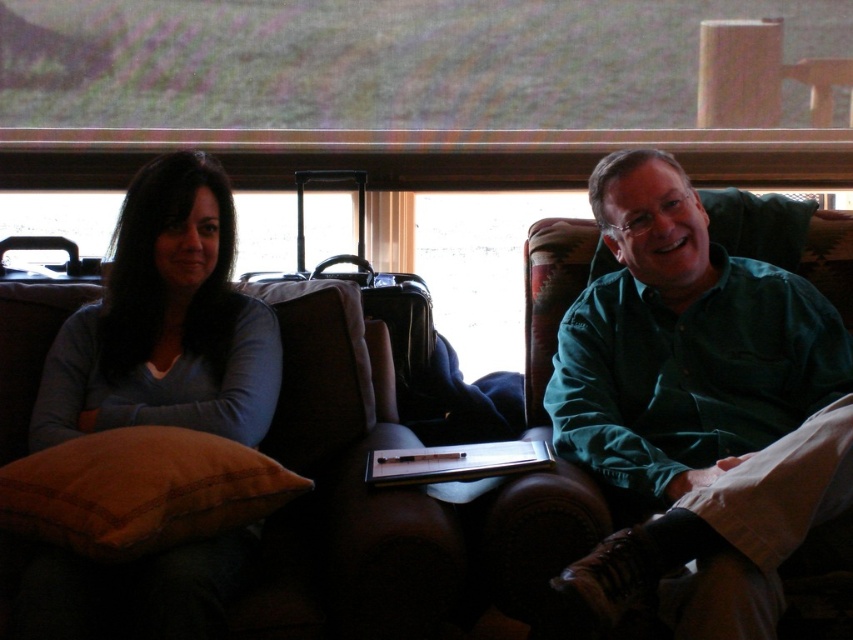
Can you confirm if matte blue shirt at left is bigger than brown velvety pillow at lower left?

Indeed, matte blue shirt at left has a larger size compared to brown velvety pillow at lower left.

Which is more to the left, matte blue shirt at left or brown velvety pillow at lower left?

From the viewer's perspective, matte blue shirt at left appears more on the left side.

Between point (236, 547) and point (77, 465), which one is positioned behind?

Positioned behind is point (236, 547).

Where is `matte blue shirt at left`? matte blue shirt at left is located at coordinates (166, 323).

Is green cotton shirt at center further to camera compared to brown suede couch at left?

No, it is not.

Is point (674, 211) closer to camera compared to point (277, 449)?

Yes, it is.

Between point (813, 381) and point (302, 364), which one is positioned in front?

Point (813, 381) is more forward.

Where is `green cotton shirt at center`? The height and width of the screenshot is (640, 853). green cotton shirt at center is located at coordinates (685, 392).

Can you confirm if green cotton shirt at center is positioned below brown velvety pillow at lower left?

No.

Does green cotton shirt at center have a lesser width compared to brown velvety pillow at lower left?

No, green cotton shirt at center is not thinner than brown velvety pillow at lower left.

Between point (699, 477) and point (184, 515), which one is positioned behind?

Positioned behind is point (699, 477).

The image size is (853, 640). In order to click on green cotton shirt at center in this screenshot , I will do `click(685, 392)`.